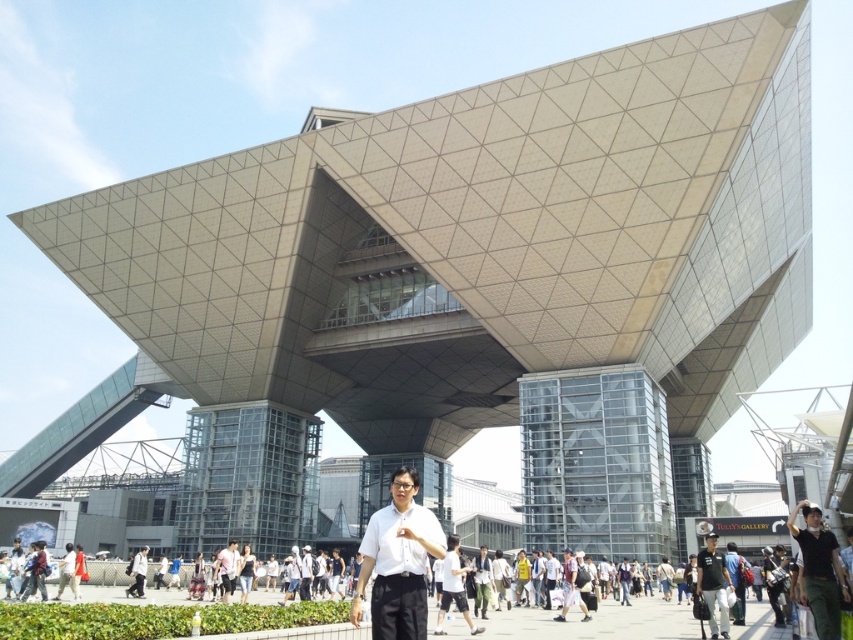
Does white matte shirt at center appear on the left side of green fabric pants at lower right?

Correct, you'll find white matte shirt at center to the left of green fabric pants at lower right.

Measure the distance between white matte shirt at center and camera.

21.22 meters

Which is behind, point (358, 611) or point (810, 566)?

The point (810, 566) is more distant.

At what (x,y) coordinates should I click in order to perform the action: click on white matte shirt at center. Please return your answer as a coordinate pair (x, y). Looking at the image, I should click on (398, 561).

Who is more distant from viewer, (x=387, y=580) or (x=703, y=548)?

Point (x=703, y=548)

Measure the distance between point (426, 522) and camera.

Point (426, 522) is 23.67 meters away from camera.

Where is `white matte shirt at center`? The width and height of the screenshot is (853, 640). white matte shirt at center is located at coordinates (398, 561).

In the scene shown: Does green fabric pants at lower right have a lesser width compared to white shirt at center?

No.

Does point (822, 572) come farther from viewer compared to point (142, 554)?

No, it is in front of (142, 554).

Locate an element on the screen. Image resolution: width=853 pixels, height=640 pixels. green fabric pants at lower right is located at coordinates (819, 570).